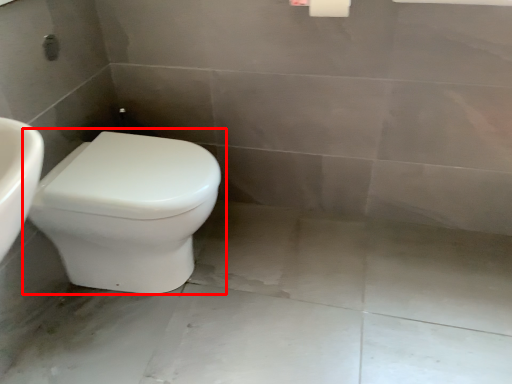
Question: From the image's perspective, where is toilet (annotated by the red box) located in relation to concrete in the image?

Choices:
 (A) above
 (B) below

Answer: (A)